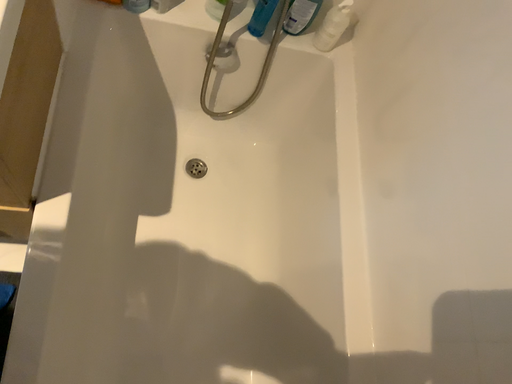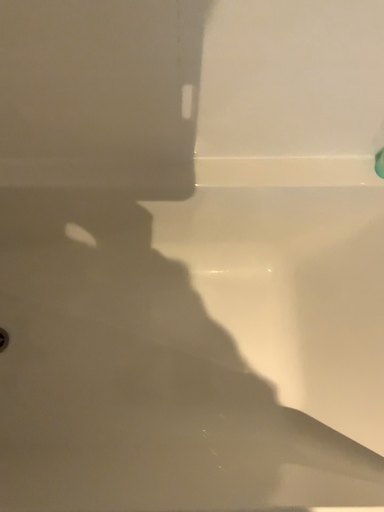
Question: Which way did the camera rotate in the video?

Choices:
 (A) rotated left
 (B) rotated right

Answer: (B)